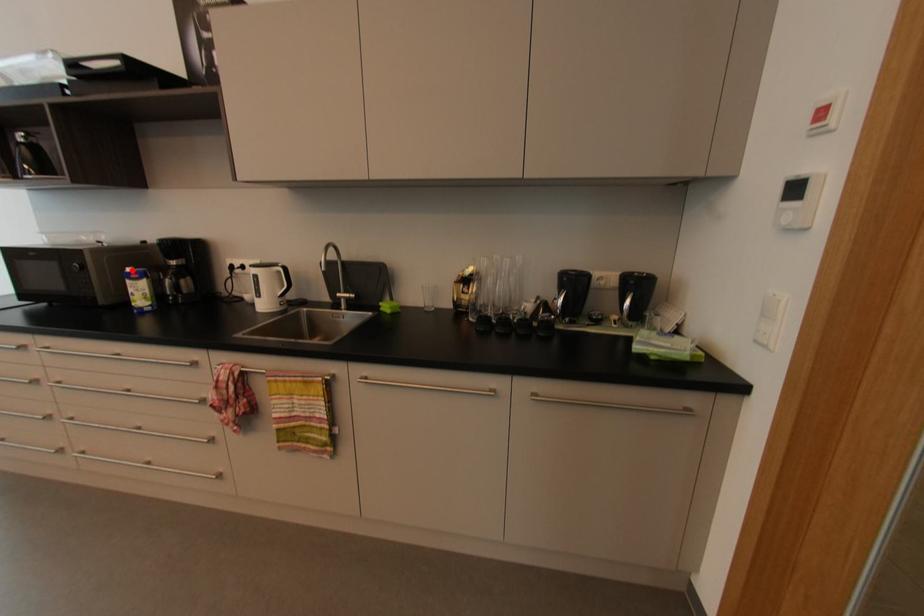
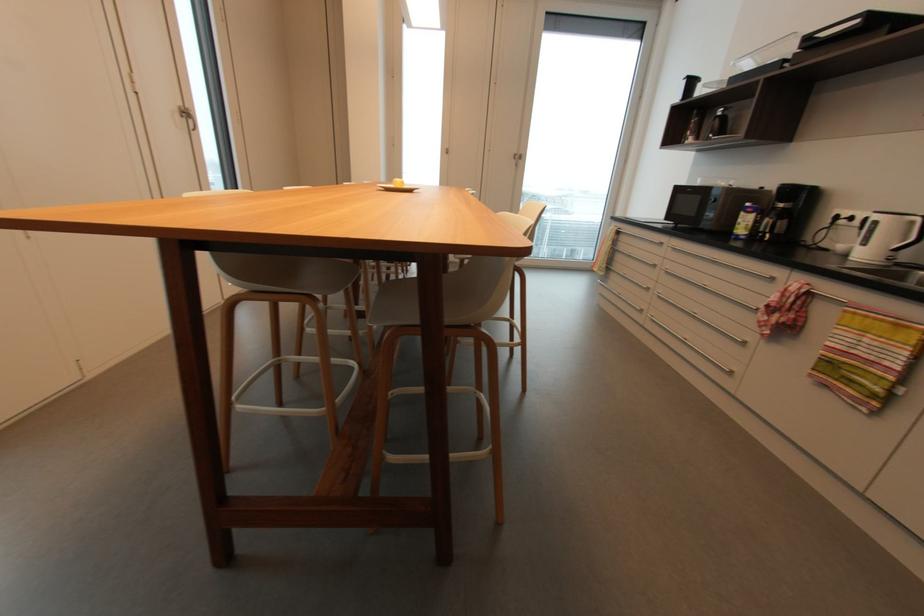
Find the pixel in the second image that matches the highlighted location in the first image.

(750, 205)